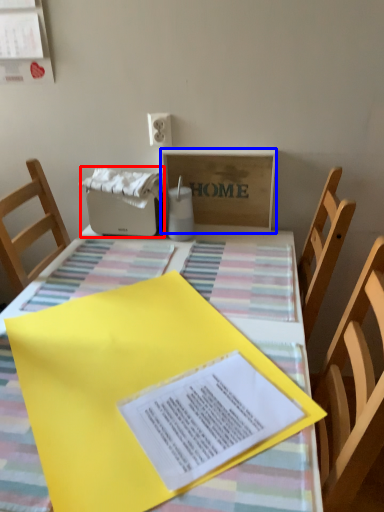
Question: Which object is further to the camera taking this photo, appliance (highlighted by a red box) or cardboard box (highlighted by a blue box)?

Choices:
 (A) appliance
 (B) cardboard box

Answer: (A)